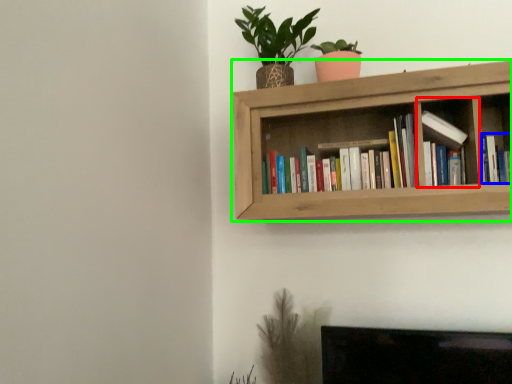
Question: Considering the real-world distances, which object is farthest from cabinet (highlighted by a red box)? book (highlighted by a blue box) or shelf (highlighted by a green box)?

Choices:
 (A) book
 (B) shelf

Answer: (B)